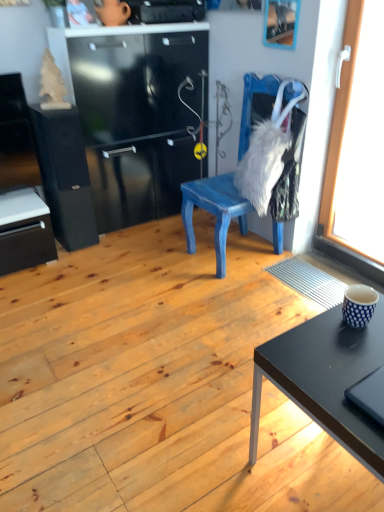
The width and height of the screenshot is (384, 512). I want to click on vacant space to the left of blue dotted cup at right, so click(x=318, y=330).